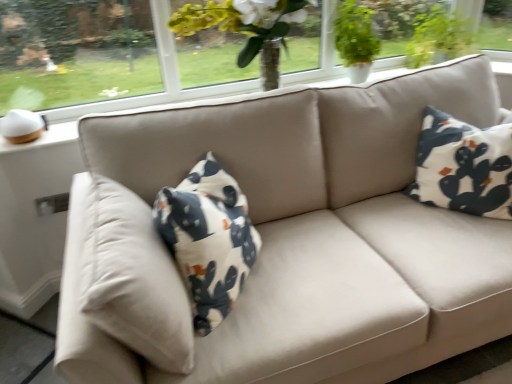
Question: Considering the relative sizes of green matte plant at upper right and white cotton pillow at right in the image provided, is green matte plant at upper right shorter than white cotton pillow at right?

Choices:
 (A) no
 (B) yes

Answer: (B)

Question: Is green matte plant at upper right smaller than white cotton pillow at right?

Choices:
 (A) no
 (B) yes

Answer: (B)

Question: Is green matte plant at upper right looking in the opposite direction of white cotton pillow at right?

Choices:
 (A) yes
 (B) no

Answer: (B)

Question: From a real-world perspective, is green matte plant at upper right physically above white cotton pillow at right?

Choices:
 (A) no
 (B) yes

Answer: (B)

Question: Is green matte plant at upper right completely or partially outside of white cotton pillow at right?

Choices:
 (A) yes
 (B) no

Answer: (A)

Question: From a real-world perspective, is green matte plant at upper right located beneath white cotton pillow at right?

Choices:
 (A) no
 (B) yes

Answer: (A)

Question: From the image's perspective, is green matte plant at upper right below transparent glass window at upper left?

Choices:
 (A) no
 (B) yes

Answer: (A)

Question: From the image's perspective, does green matte plant at upper right appear higher than transparent glass window at upper left?

Choices:
 (A) no
 (B) yes

Answer: (B)

Question: Is green matte plant at upper right with transparent glass window at upper left?

Choices:
 (A) no
 (B) yes

Answer: (A)

Question: From a real-world perspective, is green matte plant at upper right physically above transparent glass window at upper left?

Choices:
 (A) no
 (B) yes

Answer: (A)

Question: Are green matte plant at upper right and transparent glass window at upper left located far from each other?

Choices:
 (A) no
 (B) yes

Answer: (B)

Question: Considering the relative sizes of green matte plant at upper right and transparent glass window at upper left in the image provided, is green matte plant at upper right taller than transparent glass window at upper left?

Choices:
 (A) no
 (B) yes

Answer: (A)

Question: From a real-world perspective, is transparent glass window at upper left on green matte plant at upper right?

Choices:
 (A) yes
 (B) no

Answer: (A)